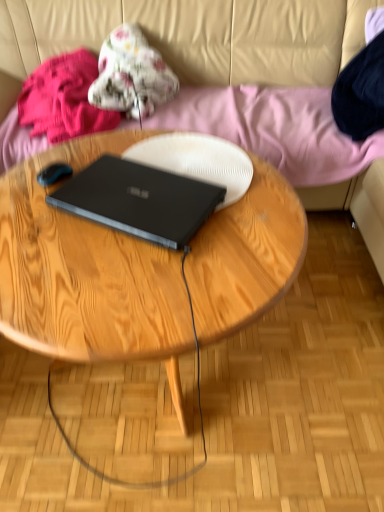
Question: Can you confirm if fluffy floral blanket at upper center, which is the 1th clothing from right to left, is wider than fluffy pink blanket at upper left, marked as the first clothing in a left-to-right arrangement?

Choices:
 (A) no
 (B) yes

Answer: (A)

Question: Considering the relative sizes of fluffy floral blanket at upper center, which is the 1th clothing from right to left, and fluffy pink blanket at upper left, marked as the first clothing in a left-to-right arrangement, in the image provided, is fluffy floral blanket at upper center, which is the 1th clothing from right to left, thinner than fluffy pink blanket at upper left, marked as the first clothing in a left-to-right arrangement,?

Choices:
 (A) no
 (B) yes

Answer: (B)

Question: Considering the relative sizes of fluffy floral blanket at upper center, placed as the 2th clothing when sorted from left to right, and fluffy pink blanket at upper left, marked as the first clothing in a left-to-right arrangement, in the image provided, is fluffy floral blanket at upper center, placed as the 2th clothing when sorted from left to right, taller than fluffy pink blanket at upper left, marked as the first clothing in a left-to-right arrangement,?

Choices:
 (A) yes
 (B) no

Answer: (A)

Question: From the image's perspective, would you say fluffy floral blanket at upper center, placed as the 2th clothing when sorted from left to right, is positioned over fluffy pink blanket at upper left, marked as the first clothing in a left-to-right arrangement?

Choices:
 (A) yes
 (B) no

Answer: (A)

Question: Considering the relative sizes of fluffy floral blanket at upper center, which is the 1th clothing from right to left, and fluffy pink blanket at upper left, the 2th clothing viewed from the right, in the image provided, is fluffy floral blanket at upper center, which is the 1th clothing from right to left, bigger than fluffy pink blanket at upper left, the 2th clothing viewed from the right,?

Choices:
 (A) yes
 (B) no

Answer: (B)

Question: In terms of height, does fluffy floral blanket at upper center, which is the 1th clothing from right to left, look taller or shorter compared to fluffy pink blanket at upper left, marked as the first clothing in a left-to-right arrangement?

Choices:
 (A) tall
 (B) short

Answer: (A)

Question: From the image's perspective, relative to fluffy pink blanket at upper left, the 2th clothing viewed from the right, is fluffy floral blanket at upper center, placed as the 2th clothing when sorted from left to right, above or below?

Choices:
 (A) below
 (B) above

Answer: (B)

Question: In the image, is fluffy floral blanket at upper center, placed as the 2th clothing when sorted from left to right, positioned in front of or behind fluffy pink blanket at upper left, the 2th clothing viewed from the right?

Choices:
 (A) front
 (B) behind

Answer: (B)

Question: Considering the positions of point (112, 106) and point (79, 67), is point (112, 106) closer or farther from the camera than point (79, 67)?

Choices:
 (A) closer
 (B) farther

Answer: (A)

Question: Is beige leather couch at upper center taller or shorter than wooden coffee table at center?

Choices:
 (A) short
 (B) tall

Answer: (B)

Question: From the image's perspective, is beige leather couch at upper center above or below wooden coffee table at center?

Choices:
 (A) above
 (B) below

Answer: (A)

Question: Based on their positions, is beige leather couch at upper center located to the left or right of wooden coffee table at center?

Choices:
 (A) right
 (B) left

Answer: (B)

Question: Is beige leather couch at upper center inside or outside of wooden coffee table at center?

Choices:
 (A) inside
 (B) outside

Answer: (B)

Question: From the image's perspective, relative to wooden coffee table at center, is fluffy pink blanket at upper left, the 2th clothing viewed from the right, above or below?

Choices:
 (A) above
 (B) below

Answer: (A)

Question: Do you think fluffy pink blanket at upper left, the 2th clothing viewed from the right, is within wooden coffee table at center, or outside of it?

Choices:
 (A) outside
 (B) inside

Answer: (A)